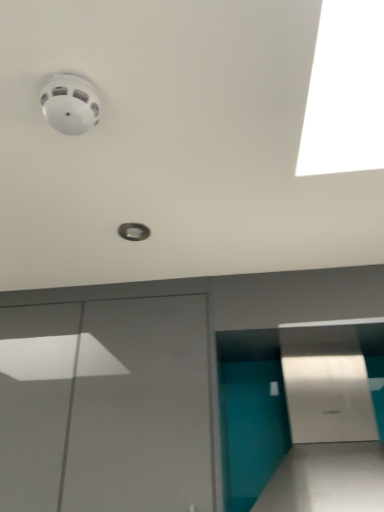
Question: Considering the relative sizes of white glossy door at lower left and teal glossy wall at lower right in the image provided, is white glossy door at lower left smaller than teal glossy wall at lower right?

Choices:
 (A) yes
 (B) no

Answer: (B)

Question: Is there a large distance between white glossy door at lower left and teal glossy wall at lower right?

Choices:
 (A) no
 (B) yes

Answer: (A)

Question: Does white glossy door at lower left have a greater height compared to teal glossy wall at lower right?

Choices:
 (A) no
 (B) yes

Answer: (B)

Question: Considering the relative positions of white glossy door at lower left and teal glossy wall at lower right in the image provided, is white glossy door at lower left to the left of teal glossy wall at lower right from the viewer's perspective?

Choices:
 (A) no
 (B) yes

Answer: (B)

Question: Is teal glossy wall at lower right completely or partially inside white glossy door at lower left?

Choices:
 (A) no
 (B) yes

Answer: (A)

Question: From the image's perspective, is white glossy door at lower left under teal glossy wall at lower right?

Choices:
 (A) yes
 (B) no

Answer: (A)

Question: Considering the relative sizes of teal glossy wall at lower right and white glossy door at lower left in the image provided, is teal glossy wall at lower right bigger than white glossy door at lower left?

Choices:
 (A) no
 (B) yes

Answer: (A)

Question: Considering the relative positions of teal glossy wall at lower right and white glossy door at lower left in the image provided, is teal glossy wall at lower right to the left of white glossy door at lower left from the viewer's perspective?

Choices:
 (A) yes
 (B) no

Answer: (B)

Question: Does teal glossy wall at lower right have a lesser height compared to white glossy door at lower left?

Choices:
 (A) yes
 (B) no

Answer: (A)

Question: From the image's perspective, is teal glossy wall at lower right located above white glossy door at lower left?

Choices:
 (A) no
 (B) yes

Answer: (B)

Question: Is teal glossy wall at lower right taller than white glossy door at lower left?

Choices:
 (A) no
 (B) yes

Answer: (A)

Question: From a real-world perspective, is teal glossy wall at lower right positioned over white glossy door at lower left based on gravity?

Choices:
 (A) yes
 (B) no

Answer: (B)

Question: Is white glossy door at lower left in front of or behind teal glossy wall at lower right in the image?

Choices:
 (A) behind
 (B) front

Answer: (A)